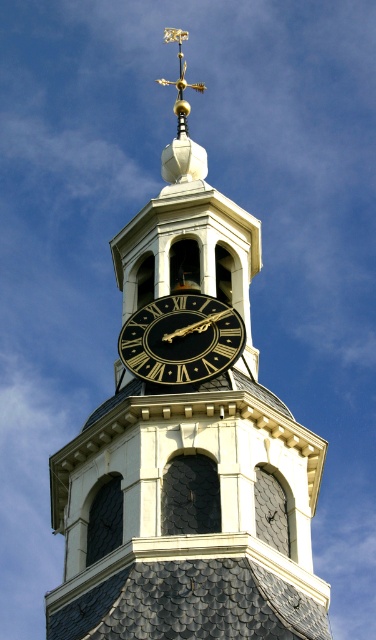
Between black clock tower at center and black polished clock at center, which one appears on the right side from the viewer's perspective?

From the viewer's perspective, black polished clock at center appears more on the right side.

Which of these two, black clock tower at center or black polished clock at center, stands taller?

Standing taller between the two is black clock tower at center.

Is point (141, 604) less distant than point (238, 324)?

That is True.

I want to click on black clock tower at center, so click(188, 442).